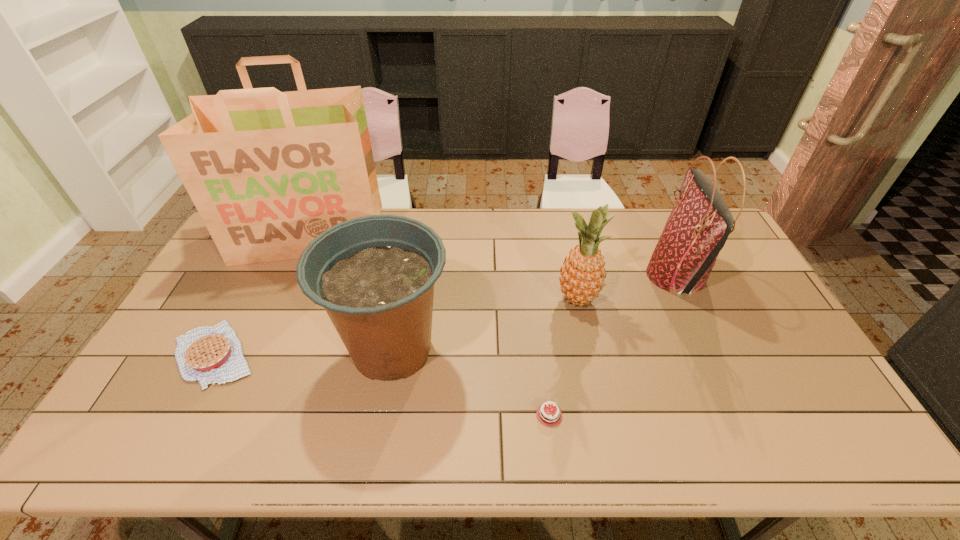
At what (x,y) coordinates should I click in order to perform the action: click on vacant space located on the front of the fifth tallest object. Please return your answer as a coordinate pair (x, y). The height and width of the screenshot is (540, 960). Looking at the image, I should click on (161, 456).

The image size is (960, 540). Find the location of `vacant point located 0.230m on the back of the shortest object`. vacant point located 0.230m on the back of the shortest object is located at coordinates tap(538, 319).

Image resolution: width=960 pixels, height=540 pixels. Identify the location of grocery bag located at the far edge. (268, 171).

The image size is (960, 540). In order to click on handbag located at the far edge in this screenshot , I will do `click(700, 222)`.

Locate an element on the screen. object that is at the near edge is located at coordinates (551, 417).

The image size is (960, 540). I want to click on grocery bag at the left edge, so click(x=268, y=171).

Find the location of a particular element. The height and width of the screenshot is (540, 960). pie that is at the left edge is located at coordinates click(x=213, y=355).

Locate an element on the screen. object that is at the right edge is located at coordinates (700, 222).

Identify the location of object present at the far left corner. This screenshot has width=960, height=540. (268, 171).

I want to click on object positioned at the far right corner, so click(700, 222).